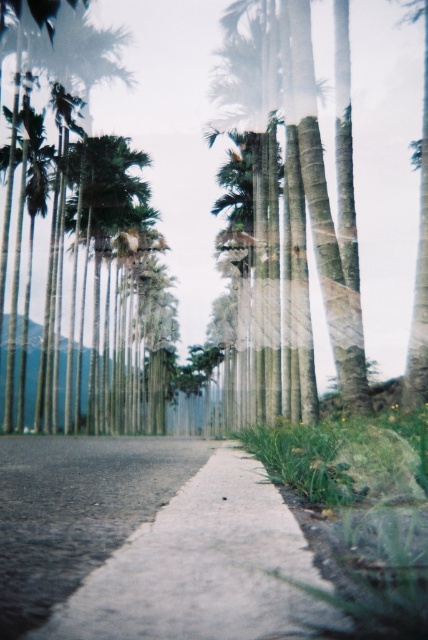
You are standing at the start of the pathway and want to walk towards the mountains in the background. Which direction should you move relative to the gray concrete pavement at center and the green leafy palm tree at center?

You should move towards the gray concrete pavement at center since it is to the right of the green leafy palm tree at center, indicating the pathway continues in that direction towards the mountains.